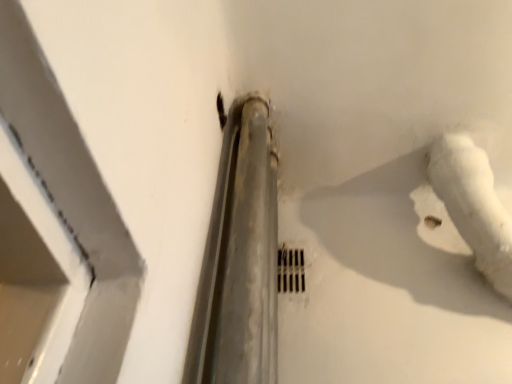
Question: Is the position of metallic grid at center less distant than that of white matte water pipe at center-right?

Choices:
 (A) no
 (B) yes

Answer: (A)

Question: From a real-world perspective, is metallic grid at center over white matte water pipe at center-right?

Choices:
 (A) yes
 (B) no

Answer: (B)

Question: From a real-world perspective, is metallic grid at center under white matte water pipe at center-right?

Choices:
 (A) no
 (B) yes

Answer: (B)

Question: From the image's perspective, would you say metallic grid at center is positioned over white matte water pipe at center-right?

Choices:
 (A) yes
 (B) no

Answer: (B)

Question: Can you confirm if metallic grid at center is thinner than white matte water pipe at center-right?

Choices:
 (A) no
 (B) yes

Answer: (B)

Question: Is metallic grid at center wider than white matte water pipe at center-right?

Choices:
 (A) yes
 (B) no

Answer: (B)

Question: Can you confirm if white matte water pipe at center-right is bigger than metallic grid at center?

Choices:
 (A) yes
 (B) no

Answer: (A)

Question: Considering the relative sizes of white matte water pipe at center-right and metallic grid at center in the image provided, is white matte water pipe at center-right smaller than metallic grid at center?

Choices:
 (A) yes
 (B) no

Answer: (B)

Question: Is white matte water pipe at center-right oriented towards metallic grid at center?

Choices:
 (A) no
 (B) yes

Answer: (A)

Question: Does white matte water pipe at center-right contain metallic grid at center?

Choices:
 (A) yes
 (B) no

Answer: (B)

Question: Is white matte water pipe at center-right to the left of metallic grid at center from the viewer's perspective?

Choices:
 (A) yes
 (B) no

Answer: (B)

Question: Does white matte water pipe at center-right lie behind metallic grid at center?

Choices:
 (A) no
 (B) yes

Answer: (A)

Question: From a real-world perspective, is white matte water pipe at center-right positioned above or below metallic grid at center?

Choices:
 (A) above
 (B) below

Answer: (A)